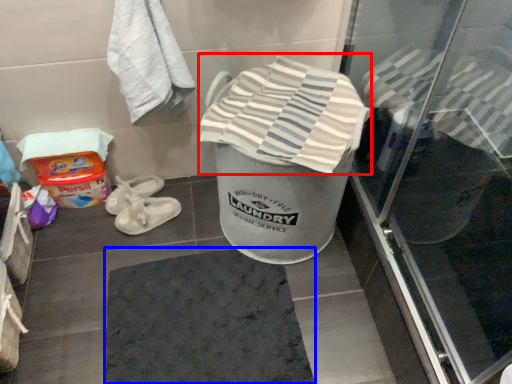
Question: Which of the following is the closest to the observer, beach towel (highlighted by a red box) or bath mat (highlighted by a blue box)?

Choices:
 (A) beach towel
 (B) bath mat

Answer: (A)